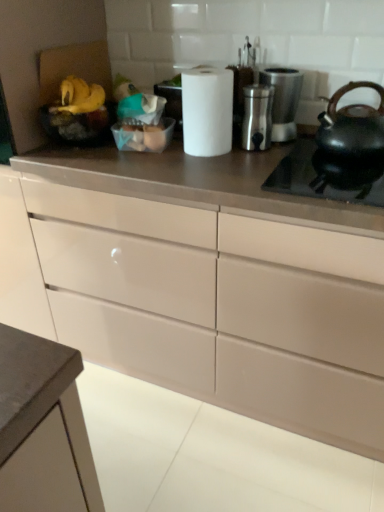
Question: Can you confirm if satin silver container at center, which appears as the 2th appliance when viewed from the right, is taller than yellow matte bananas at upper left, which is the 2th food from right to left?

Choices:
 (A) no
 (B) yes

Answer: (B)

Question: Is satin silver container at center, the 1th appliance from the left, shorter than yellow matte bananas at upper left, which appears as the first food when viewed from the left?

Choices:
 (A) no
 (B) yes

Answer: (A)

Question: From a real-world perspective, is satin silver container at center, the 1th appliance from the left, on top of yellow matte bananas at upper left, which is the 2th food from right to left?

Choices:
 (A) no
 (B) yes

Answer: (A)

Question: Is satin silver container at center, which appears as the 2th appliance when viewed from the right, facing towards yellow matte bananas at upper left, which appears as the first food when viewed from the left?

Choices:
 (A) no
 (B) yes

Answer: (A)

Question: Can you confirm if satin silver container at center, the 1th appliance from the left, is wider than yellow matte bananas at upper left, which is the 2th food from right to left?

Choices:
 (A) yes
 (B) no

Answer: (B)

Question: Based on their sizes in the image, would you say satin silver container at center, the 1th appliance from the left, is bigger or smaller than white matte paper towel at center?

Choices:
 (A) small
 (B) big

Answer: (A)

Question: From a real-world perspective, is satin silver container at center, the 1th appliance from the left, above or below white matte paper towel at center?

Choices:
 (A) above
 (B) below

Answer: (B)

Question: In terms of height, does satin silver container at center, the 1th appliance from the left, look taller or shorter compared to white matte paper towel at center?

Choices:
 (A) short
 (B) tall

Answer: (A)

Question: Does point (258, 105) appear closer or farther from the camera than point (208, 82)?

Choices:
 (A) farther
 (B) closer

Answer: (A)

Question: Does point (266, 144) appear closer or farther from the camera than point (168, 289)?

Choices:
 (A) closer
 (B) farther

Answer: (A)

Question: From a real-world perspective, relative to matte white drawers at center, is satin silver container at center, the 1th appliance from the left, vertically above or below?

Choices:
 (A) above
 (B) below

Answer: (A)

Question: In terms of width, does satin silver container at center, which appears as the 2th appliance when viewed from the right, look wider or thinner when compared to matte white drawers at center?

Choices:
 (A) thin
 (B) wide

Answer: (A)

Question: Considering their positions, is satin silver container at center, the 1th appliance from the left, located in front of or behind matte white drawers at center?

Choices:
 (A) behind
 (B) front

Answer: (A)

Question: Based on their sizes in the image, would you say matte black kettle at right is bigger or smaller than matte white drawers at center?

Choices:
 (A) big
 (B) small

Answer: (B)

Question: Is matte black kettle at right to the left or to the right of matte white drawers at center in the image?

Choices:
 (A) left
 (B) right

Answer: (B)